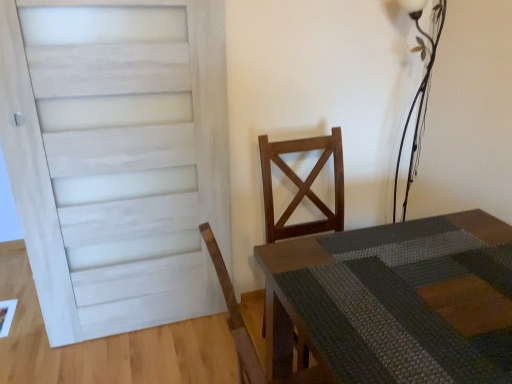
Where is `wooden chair at center`? The width and height of the screenshot is (512, 384). wooden chair at center is located at coordinates (302, 185).

The width and height of the screenshot is (512, 384). Describe the element at coordinates (369, 305) in the screenshot. I see `rustic wood table at center` at that location.

The image size is (512, 384). I want to click on white painted wood door at left, so click(117, 157).

Identify the location of wooden chair at center. The width and height of the screenshot is (512, 384). (302, 185).

Is metallic wire at upper right far from wooden chair at center?

No, metallic wire at upper right is not far away from wooden chair at center.

Consider the image. Considering the sizes of objects metallic wire at upper right and wooden chair at center in the image provided, who is wider, metallic wire at upper right or wooden chair at center?

wooden chair at center.

From a real-world perspective, which is physically below, metallic wire at upper right or wooden chair at center?

wooden chair at center, from a real-world perspective.

Considering their positions, is metallic wire at upper right located in front of or behind wooden chair at center?

metallic wire at upper right is positioned farther from the viewer than wooden chair at center.

Which object is positioned more to the left, white painted wood door at left or metallic wire at upper right?

From the viewer's perspective, white painted wood door at left appears more on the left side.

Locate an element on the screen. table lamp lying on the right of white painted wood door at left is located at coordinates (418, 93).

Is white painted wood door at left looking in the opposite direction of metallic wire at upper right?

white painted wood door at left is not turned away from metallic wire at upper right.

Does white painted wood door at left have a lesser width compared to metallic wire at upper right?

Yes.

Which is more to the right, rustic wood table at center or white painted wood door at left?

rustic wood table at center is more to the right.

Between point (348, 273) and point (95, 11), which one is positioned behind?

The point (95, 11) is farther.

Between rustic wood table at center and white painted wood door at left, which one has less height?

With less height is rustic wood table at center.

Considering the relative positions of white painted wood door at left and rustic wood table at center in the image provided, is white painted wood door at left to the left of rustic wood table at center from the viewer's perspective?

Yes, white painted wood door at left is to the left of rustic wood table at center.

Locate an element on the screen. Image resolution: width=512 pixels, height=384 pixels. door behind the rustic wood table at center is located at coordinates (117, 157).

From the image's perspective, is white painted wood door at left above rustic wood table at center?

Yes, from the image's perspective, white painted wood door at left is over rustic wood table at center.

Considering the relative sizes of white painted wood door at left and rustic wood table at center in the image provided, is white painted wood door at left bigger than rustic wood table at center?

Actually, white painted wood door at left might be smaller than rustic wood table at center.

From a real-world perspective, who is located lower, metallic wire at upper right or rustic wood table at center?

From a 3D spatial view, rustic wood table at center is below.

Looking at this image, does metallic wire at upper right have a smaller size compared to rustic wood table at center?

Yes.

Is metallic wire at upper right looking in the opposite direction of rustic wood table at center?

No.

Is metallic wire at upper right next to rustic wood table at center?

No, metallic wire at upper right is not beside rustic wood table at center.

Find the location of a particular element. The height and width of the screenshot is (384, 512). table lying on the right of wooden chair at center is located at coordinates (369, 305).

From the image's perspective, is wooden chair at center under rustic wood table at center?

No, from the image's perspective, wooden chair at center is not beneath rustic wood table at center.

Are wooden chair at center and rustic wood table at center located far from each other?

No.

Considering the relative sizes of wooden chair at center and rustic wood table at center in the image provided, is wooden chair at center bigger than rustic wood table at center?

No, wooden chair at center is not bigger than rustic wood table at center.

At what (x,y) coordinates should I click in order to perform the action: click on table that is below the wooden chair at center (from the image's perspective). Please return your answer as a coordinate pair (x, y). Image resolution: width=512 pixels, height=384 pixels. Looking at the image, I should click on (369, 305).

From the image's perspective, is rustic wood table at center under wooden chair at center?

Indeed, from the image's perspective, rustic wood table at center is shown beneath wooden chair at center.

Is point (380, 335) positioned in front of point (304, 142)?

That is True.

Locate an element on the screen. armchair to the left of metallic wire at upper right is located at coordinates (302, 185).

Identify the location of door located in front of the metallic wire at upper right. Image resolution: width=512 pixels, height=384 pixels. (117, 157).

Looking at the image, which one is located closer to metallic wire at upper right, rustic wood table at center or wooden chair at center?

wooden chair at center lies closer to metallic wire at upper right than the other object.

When comparing their distances from wooden chair at center, does rustic wood table at center or metallic wire at upper right seem closer?

rustic wood table at center is positioned closer to the anchor wooden chair at center.

Which object lies further to the anchor point rustic wood table at center, wooden chair at center or metallic wire at upper right?

metallic wire at upper right is positioned further to the anchor rustic wood table at center.

Considering their positions, is wooden chair at center positioned closer to metallic wire at upper right than white painted wood door at left?

Among the two, wooden chair at center is located nearer to metallic wire at upper right.

Estimate the real-world distances between objects in this image. Which object is closer to wooden chair at center, white painted wood door at left or metallic wire at upper right?

white painted wood door at left lies closer to wooden chair at center than the other object.

Looking at the image, which one is located closer to white painted wood door at left, metallic wire at upper right or rustic wood table at center?

The object closer to white painted wood door at left is rustic wood table at center.

Estimate the real-world distances between objects in this image. Which object is further from metallic wire at upper right, wooden chair at center or rustic wood table at center?

rustic wood table at center lies further to metallic wire at upper right than the other object.

When comparing their distances from rustic wood table at center, does metallic wire at upper right or wooden chair at center seem further?

metallic wire at upper right.

The height and width of the screenshot is (384, 512). I want to click on table between white painted wood door at left and metallic wire at upper right from left to right, so click(x=369, y=305).

Find the location of a particular element. armchair between white painted wood door at left and metallic wire at upper right is located at coordinates (302, 185).

Find the location of `armchair between metallic wire at upper right and rustic wood table at center from top to bottom`. armchair between metallic wire at upper right and rustic wood table at center from top to bottom is located at coordinates (302, 185).

The width and height of the screenshot is (512, 384). Find the location of `armchair between white painted wood door at left and rustic wood table at center in the horizontal direction`. armchair between white painted wood door at left and rustic wood table at center in the horizontal direction is located at coordinates (302, 185).